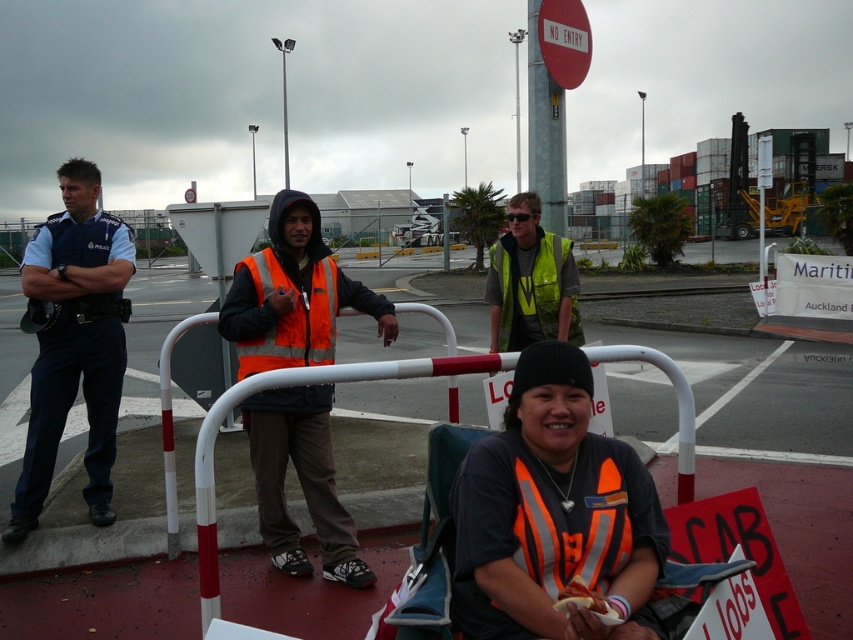
You are an inspector at the port and need to determine which orange vest is larger. You see an orange reflective vest at center and an orange reflective safety vest at center. Which one has a larger size?

The orange reflective vest at center is bigger than the orange reflective safety vest at center.